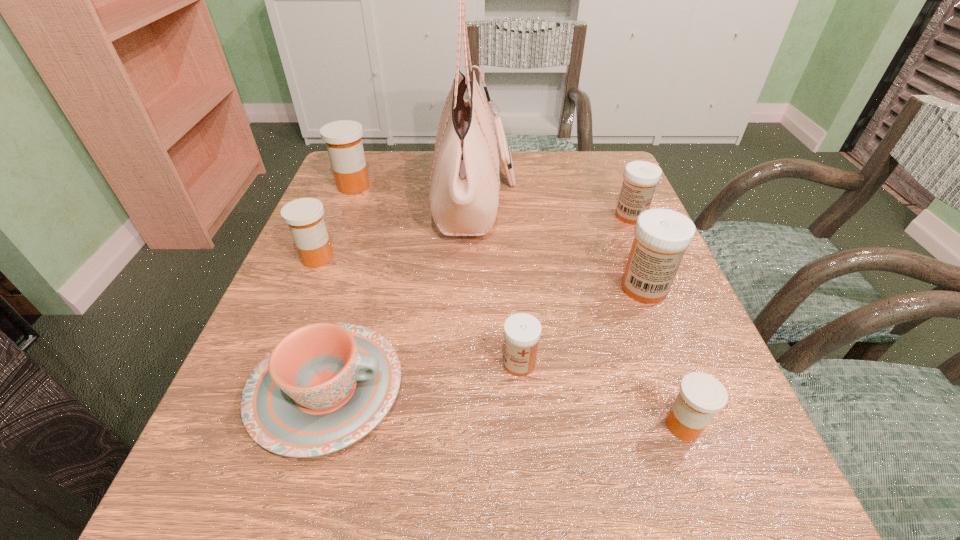
The height and width of the screenshot is (540, 960). I want to click on handbag, so click(464, 183).

Identify the location of the farthest medicine. The height and width of the screenshot is (540, 960). (343, 140).

Image resolution: width=960 pixels, height=540 pixels. What are the coordinates of `the biggest orange medicine` in the screenshot? It's located at (343, 140).

Image resolution: width=960 pixels, height=540 pixels. In order to click on the fifth farthest object in this screenshot , I will do `click(662, 235)`.

The height and width of the screenshot is (540, 960). Find the location of `the biggest white medicine`. the biggest white medicine is located at coordinates (662, 235).

What are the coordinates of `the second biggest orange medicine` in the screenshot? It's located at (304, 216).

Where is `the third farthest medicine`? This screenshot has width=960, height=540. the third farthest medicine is located at coordinates (304, 216).

Where is `the second biggest white medicine`? the second biggest white medicine is located at coordinates (640, 177).

The width and height of the screenshot is (960, 540). What are the coordinates of `the second farthest medicine` in the screenshot? It's located at 640,177.

The image size is (960, 540). I want to click on the smallest white medicine, so click(522, 331).